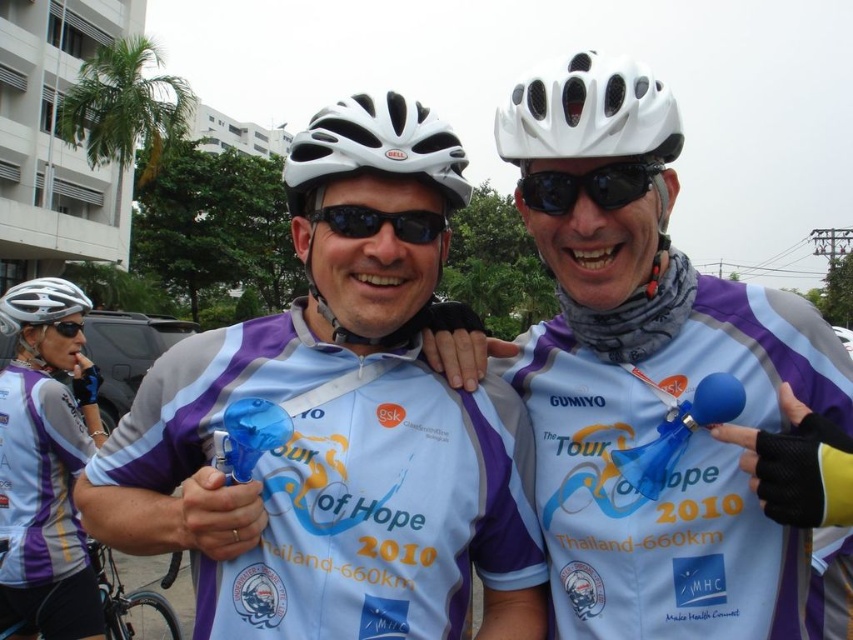
Question: Based on their relative distances, which object is farther from the black rubber goggles at upper center?

Choices:
 (A) matte blue balloon at center
 (B) matte blue helmet at upper center
 (C) black matte goggles at upper left

Answer: (C)

Question: Estimate the real-world distances between objects in this image. Which object is closer to the silver metallic bicycle at lower left?

Choices:
 (A) matte blue balloon at center
 (B) black plastic goggles at center
 (C) white matte helmet at center
 (D) black matte goggles at upper left

Answer: (D)

Question: Does white matte bicycle helmet at upper center appear over black matte goggles at upper left?

Choices:
 (A) no
 (B) yes

Answer: (B)

Question: Can you confirm if white matte helmet at upper center is positioned below black plastic goggles at center?

Choices:
 (A) no
 (B) yes

Answer: (A)

Question: Is white matte bicycle helmet at upper center below silver metallic bicycle at lower left?

Choices:
 (A) yes
 (B) no

Answer: (B)

Question: Which object appears farthest from the camera in this image?

Choices:
 (A) white matte helmet at upper center
 (B) white matte bicycle helmet at upper center
 (C) matte silver helmet at upper left

Answer: (C)